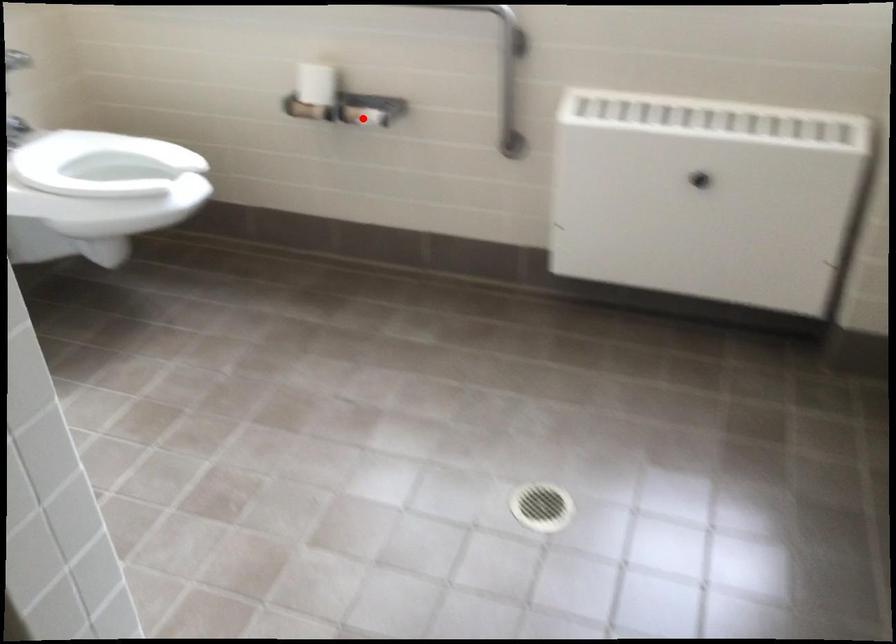
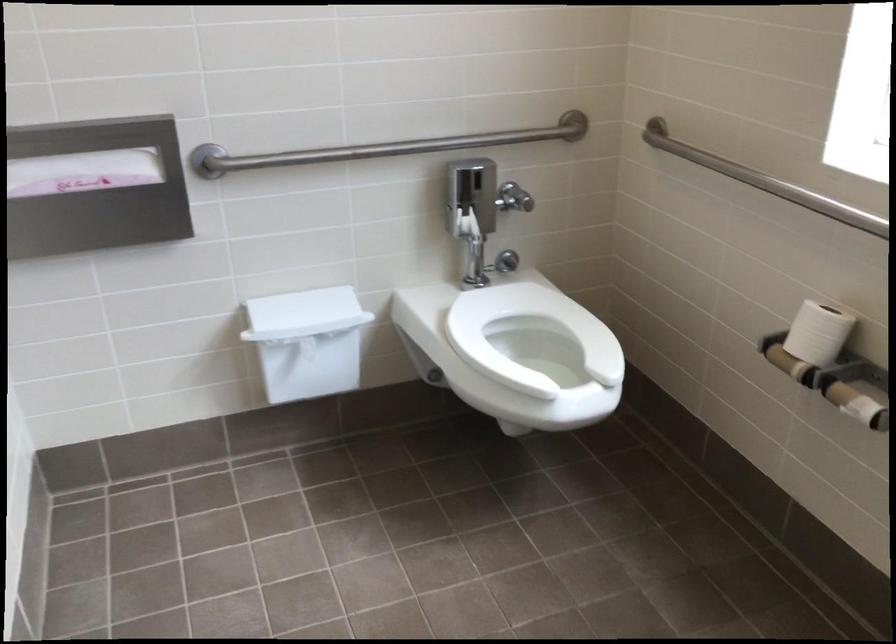
Question: I am providing you with two images of the same scene from different viewpoints. A red point is shown in image1. For the corresponding object point in image2, is it positioned nearer or farther from the camera?

Choices:
 (A) Nearer
 (B) Farther

Answer: (A)